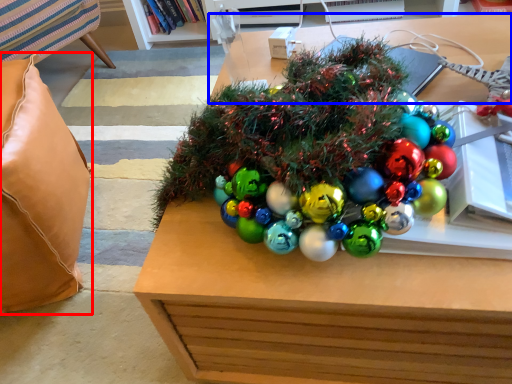
Question: Which of the following is the farthest to the observer, pillow (highlighted by a red box) or table (highlighted by a blue box)?

Choices:
 (A) pillow
 (B) table

Answer: (A)